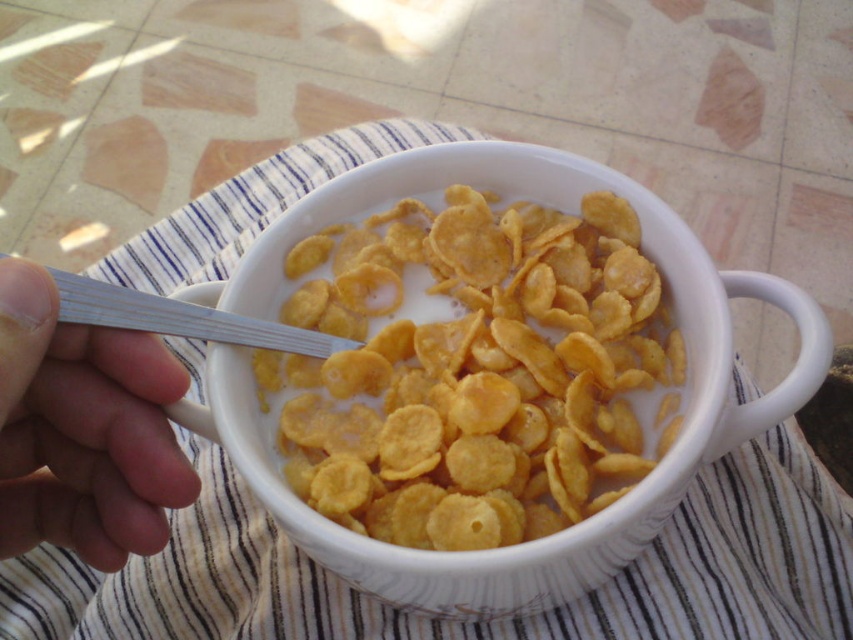
Question: Which point is closer to the camera?

Choices:
 (A) (292, 481)
 (B) (138, 541)

Answer: (B)

Question: Which point appears farthest from the camera in this image?

Choices:
 (A) (111, 490)
 (B) (67, 314)
 (C) (560, 422)

Answer: (C)

Question: Is yellow matte cornflakes at center smaller than white plastic spoon at upper left?

Choices:
 (A) no
 (B) yes

Answer: (A)

Question: Can you confirm if yellow matte cornflakes at center is thinner than white plastic spoon at center?

Choices:
 (A) no
 (B) yes

Answer: (A)

Question: Which object is farther from the camera taking this photo?

Choices:
 (A) yellow matte cornflakes at center
 (B) white plastic spoon at upper left

Answer: (A)

Question: Is white plastic spoon at upper left thinner than white plastic spoon at center?

Choices:
 (A) no
 (B) yes

Answer: (B)